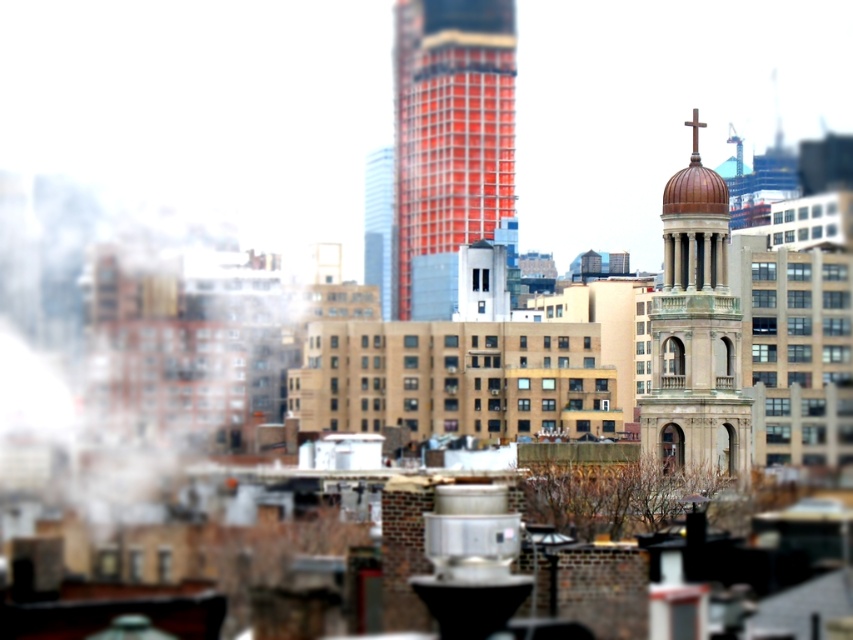
Is point (689, 349) less distant than point (369, 189)?

Yes, point (689, 349) is in front of point (369, 189).

Find the location of a particular element. The width and height of the screenshot is (853, 640). bronze domed tower at center right is located at coordinates (695, 332).

Between red glass skyscraper at center and bronze domed tower at center right, which one is positioned lower?

bronze domed tower at center right is lower down.

Is point (492, 147) farther from camera compared to point (703, 353)?

That is True.

The height and width of the screenshot is (640, 853). What are the coordinates of `red glass skyscraper at center` in the screenshot? It's located at (450, 140).

Which is behind, point (467, 1) or point (390, 221)?

The point (467, 1) is behind.

Does red glass skyscraper at center have a greater width compared to glassy orange skyscraper at center?

Correct, the width of red glass skyscraper at center exceeds that of glassy orange skyscraper at center.

Is point (410, 172) less distant than point (374, 177)?

No.

In order to click on red glass skyscraper at center in this screenshot , I will do `click(450, 140)`.